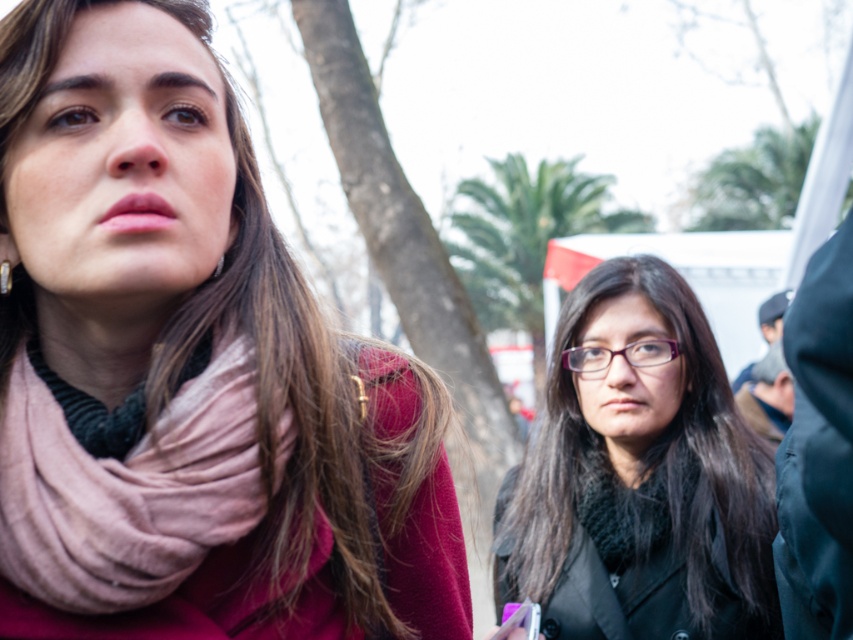
Question: Does pink fabric scarf at upper left have a lesser width compared to black matte glasses at center?

Choices:
 (A) no
 (B) yes

Answer: (B)

Question: Is black matte glasses at center below pink soft fabric scarf at left?

Choices:
 (A) no
 (B) yes

Answer: (B)

Question: Which object is positioned closest to the pink fabric scarf at upper left?

Choices:
 (A) black matte glasses at center
 (B) pink soft fabric scarf at left

Answer: (B)

Question: Among these points, which one is farthest from the camera?

Choices:
 (A) (384, 492)
 (B) (743, 532)

Answer: (B)

Question: Is pink fabric scarf at upper left to the right of pink soft fabric scarf at left from the viewer's perspective?

Choices:
 (A) no
 (B) yes

Answer: (B)

Question: Which point is farther from the camera taking this photo?

Choices:
 (A) (308, 444)
 (B) (181, 486)

Answer: (A)